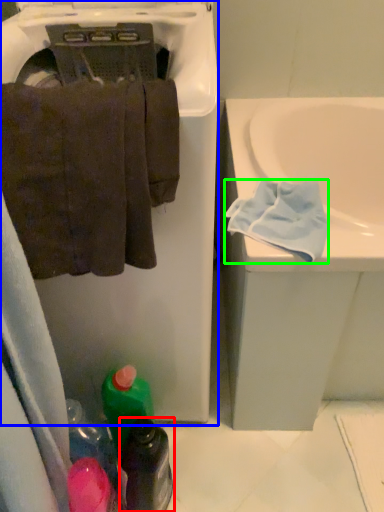
Question: Based on their relative distances, which object is farther from bottle (highlighted by a red box)? Choose from dish washer (highlighted by a blue box) and bath towel (highlighted by a green box).

Choices:
 (A) dish washer
 (B) bath towel

Answer: (B)